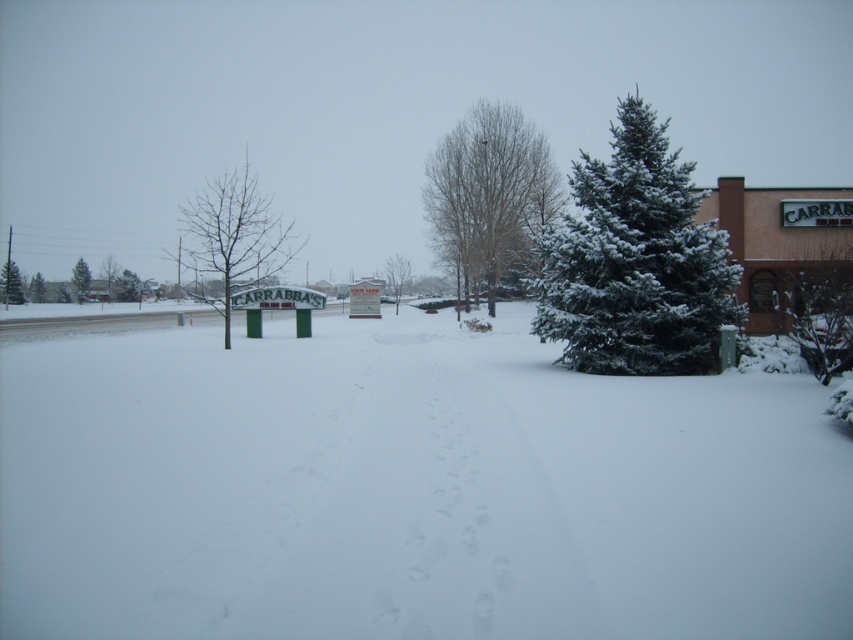
Is point (10, 266) positioned after point (115, 284)?

That is False.

At what (x,y) coordinates should I click in order to perform the action: click on green snow-covered tree at left. Please return your answer as a coordinate pair (x, y). This screenshot has height=640, width=853. Looking at the image, I should click on (10, 284).

Is white fluffy snow at center taller than green snow-covered tree at left?

In fact, white fluffy snow at center may be shorter than green snow-covered tree at left.

Between white fluffy snow at center and green snow-covered tree at left, which one has less height?

white fluffy snow at center

Describe the element at coordinates (410, 490) in the screenshot. I see `white fluffy snow at center` at that location.

This screenshot has width=853, height=640. I want to click on white fluffy snow at center, so click(410, 490).

Is green textured evergreen at center further to camera compared to green textured sign at center?

No, green textured evergreen at center is closer to the viewer.

Who is shorter, green textured evergreen at center or green textured sign at center?

green textured sign at center

What do you see at coordinates (396, 276) in the screenshot? The height and width of the screenshot is (640, 853). I see `green textured evergreen at center` at bounding box center [396, 276].

Identify the location of green textured evergreen at center. The width and height of the screenshot is (853, 640). (396, 276).